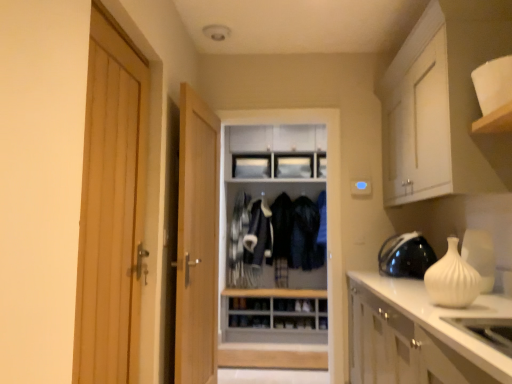
You are a GUI agent. You are given a task and a screenshot of the screen. Output one action in this format:
    pyautogui.click(x=<x>, y=<y>)
    Task: Click on the free space above light wood door at left, which is the first door from left to right (from a real-world perspective)
    The width and height of the screenshot is (512, 384).
    Given the screenshot: What is the action you would take?
    pyautogui.click(x=124, y=36)